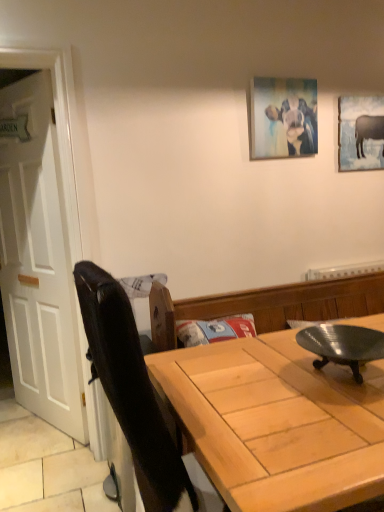
Question: Considering the relative sizes of metallic silver plate at center and light wood table at center in the image provided, is metallic silver plate at center smaller than light wood table at center?

Choices:
 (A) yes
 (B) no

Answer: (A)

Question: Does metallic silver plate at center turn towards light wood table at center?

Choices:
 (A) yes
 (B) no

Answer: (B)

Question: Can you confirm if metallic silver plate at center is positioned to the right of light wood table at center?

Choices:
 (A) no
 (B) yes

Answer: (A)

Question: Considering the relative sizes of metallic silver plate at center and light wood table at center in the image provided, is metallic silver plate at center shorter than light wood table at center?

Choices:
 (A) no
 (B) yes

Answer: (B)

Question: Considering the relative sizes of metallic silver plate at center and light wood table at center in the image provided, is metallic silver plate at center wider than light wood table at center?

Choices:
 (A) no
 (B) yes

Answer: (A)

Question: Are metallic silver plate at center and light wood table at center located far from each other?

Choices:
 (A) no
 (B) yes

Answer: (A)

Question: Is matte gray cow at upper right, the second picture frame in the left-to-right sequence, outside of white wooden door at left?

Choices:
 (A) yes
 (B) no

Answer: (A)

Question: Can white wooden door at left be found inside matte gray cow at upper right, which appears as the second picture frame when viewed from the front?

Choices:
 (A) no
 (B) yes

Answer: (A)

Question: Is matte gray cow at upper right, the 1th picture frame in the back-to-front sequence, positioned far away from white wooden door at left?

Choices:
 (A) no
 (B) yes

Answer: (B)

Question: Is matte gray cow at upper right, which appears as the second picture frame when viewed from the front, bigger than white wooden door at left?

Choices:
 (A) no
 (B) yes

Answer: (A)

Question: Is matte gray cow at upper right, the 1th picture frame in the back-to-front sequence, at the left side of white wooden door at left?

Choices:
 (A) no
 (B) yes

Answer: (A)

Question: From a real-world perspective, does matte gray cow at upper right, the first picture frame from the right, stand above white wooden door at left?

Choices:
 (A) yes
 (B) no

Answer: (A)

Question: Does metallic silver plate at center lie in front of white wooden door at left?

Choices:
 (A) yes
 (B) no

Answer: (A)